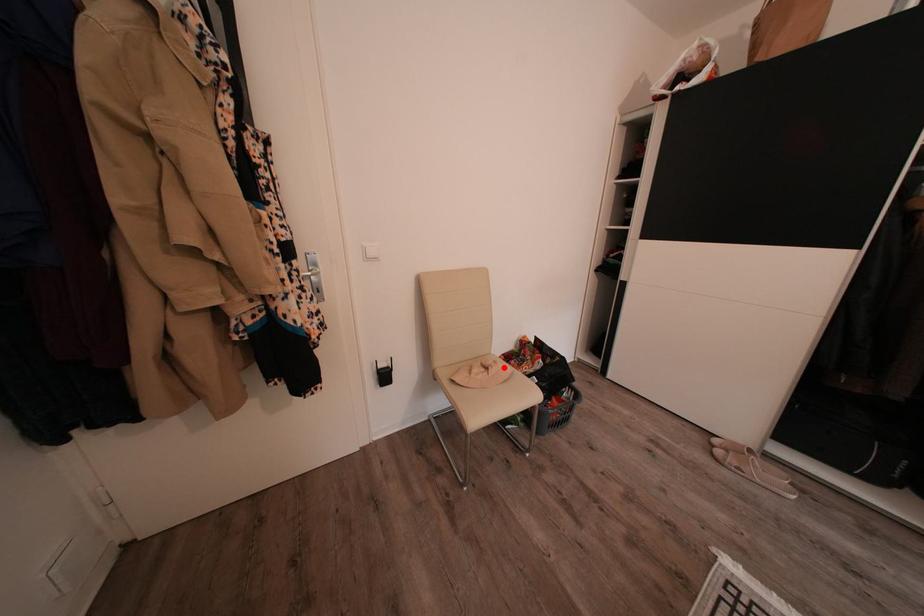
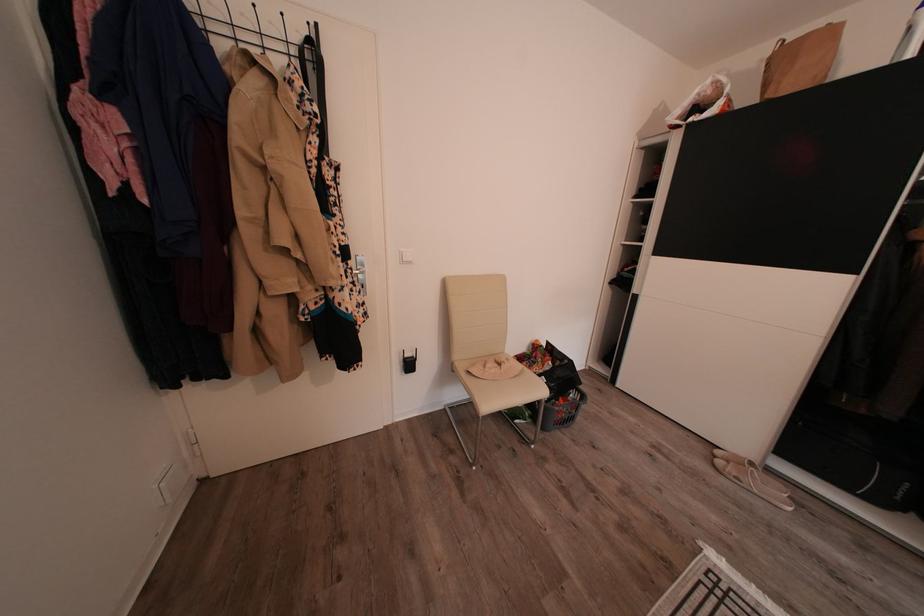
Question: I am providing you with two images of the same scene from different viewpoints. Given a red point in image1, look at the same physical point in image2. Is it:

Choices:
 (A) Closer to the viewpoint
 (B) Farther from the viewpoint

Answer: (B)